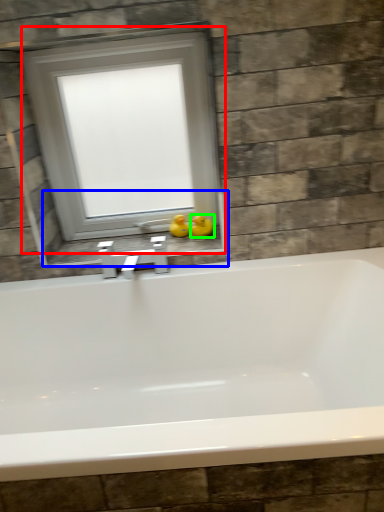
Question: Based on their relative distances, which object is farther from window (highlighted by a red box)? Choose from window sill (highlighted by a blue box) and duck (highlighted by a green box).

Choices:
 (A) window sill
 (B) duck

Answer: (B)